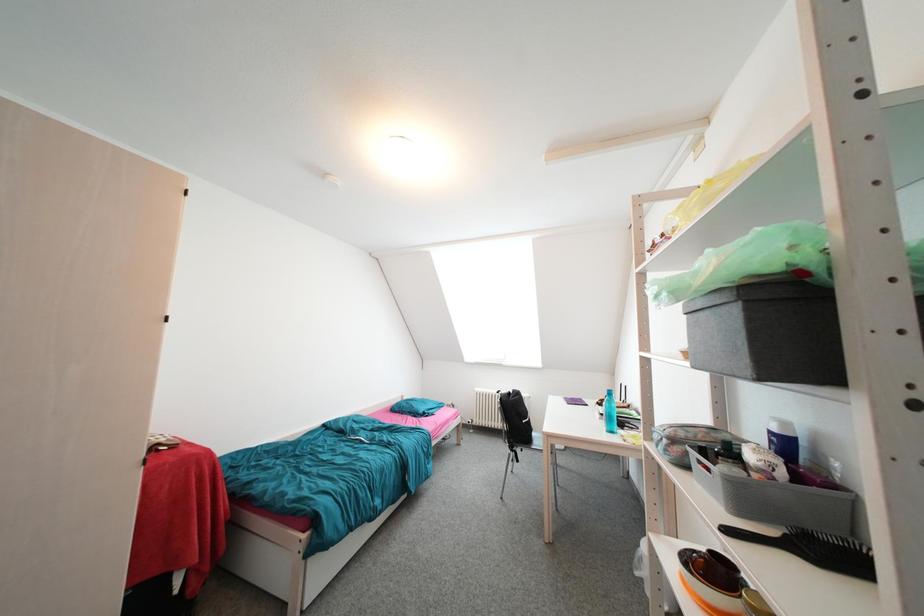
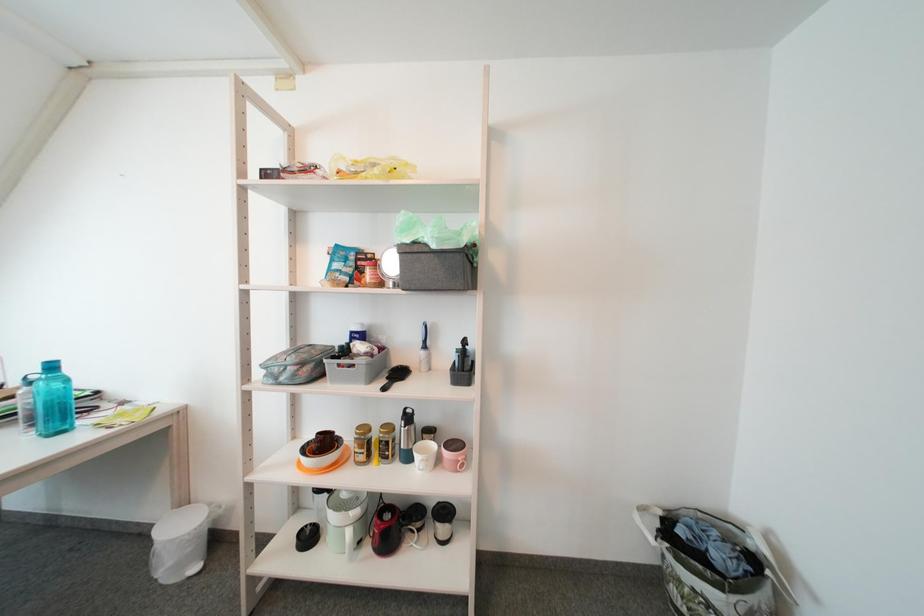
Question: Based on the continuous images, in which direction is the camera rotating? Reply with the corresponding letter.

Choices:
 (A) Left
 (B) Right
 (C) Up
 (D) Down

Answer: (B)